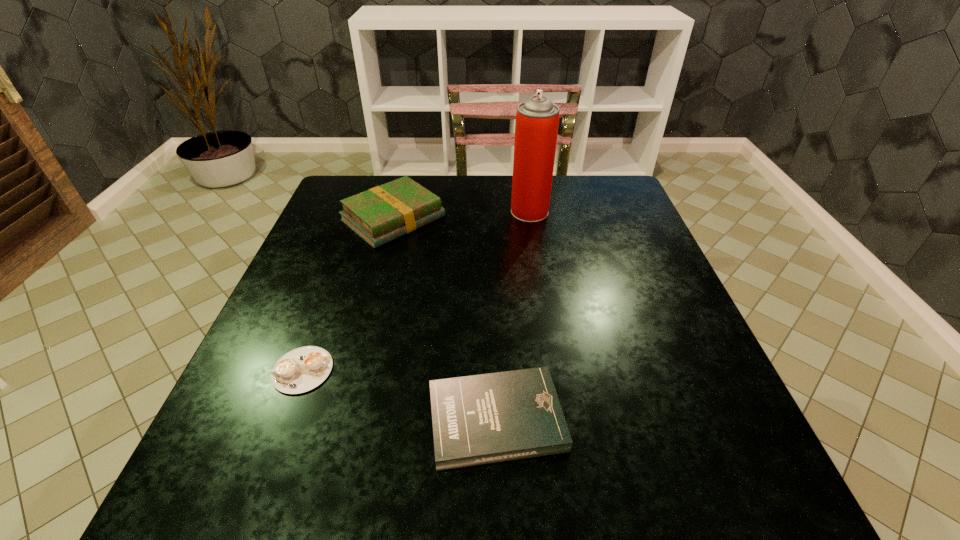
Image resolution: width=960 pixels, height=540 pixels. I want to click on the third closest object relative to the farther book, so click(480, 419).

Identify which object is the third nearest to the cappuccino. Please provide its 2D coordinates. Your answer should be formatted as a tuple, i.e. [(x, y)], where the tuple contains the x and y coordinates of a point satisfying the conditions above.

[(537, 119)]

This screenshot has height=540, width=960. What are the coordinates of `free space that satisfies the following two spatial constraints: 1. on the back side of the farther book; 2. on the right side of the shortest object` in the screenshot? It's located at (359, 219).

Where is `vacant space that satisfies the following two spatial constraints: 1. on the back side of the shortest object; 2. on the left side of the tallest object`? This screenshot has width=960, height=540. vacant space that satisfies the following two spatial constraints: 1. on the back side of the shortest object; 2. on the left side of the tallest object is located at coordinates (361, 212).